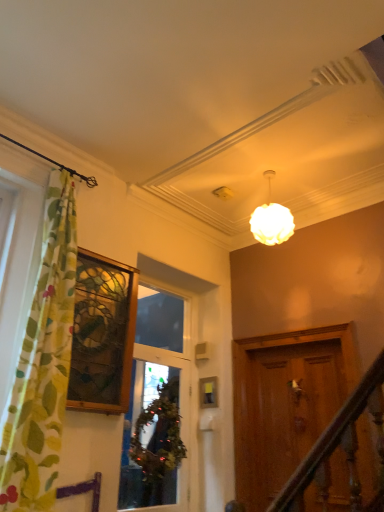
Question: From a real-world perspective, is green floral fabric curtain at left below stained glass window at left, which appears as the 1th window when viewed from the left?

Choices:
 (A) yes
 (B) no

Answer: (A)

Question: Would you say green floral fabric curtain at left is a long distance from stained glass window at left, which appears as the 1th window when viewed from the left?

Choices:
 (A) no
 (B) yes

Answer: (A)

Question: Does green floral fabric curtain at left have a smaller size compared to stained glass window at left, which appears as the 1th window when viewed from the left?

Choices:
 (A) yes
 (B) no

Answer: (B)

Question: From the image's perspective, is green floral fabric curtain at left over stained glass window at left, which appears as the 1th window when viewed from the left?

Choices:
 (A) no
 (B) yes

Answer: (B)

Question: Is green floral fabric curtain at left positioned beyond the bounds of stained glass window at left, which is the second window from right to left?

Choices:
 (A) no
 (B) yes

Answer: (B)

Question: Considering the relative positions of green floral fabric curtain at left and stained glass window at left, which appears as the 1th window when viewed from the left, in the image provided, is green floral fabric curtain at left behind stained glass window at left, which appears as the 1th window when viewed from the left,?

Choices:
 (A) yes
 (B) no

Answer: (B)

Question: Considering the relative sizes of green floral fabric curtain at left and matte white globe at upper center in the image provided, is green floral fabric curtain at left taller than matte white globe at upper center?

Choices:
 (A) no
 (B) yes

Answer: (B)

Question: From a real-world perspective, is green floral fabric curtain at left located higher than matte white globe at upper center?

Choices:
 (A) no
 (B) yes

Answer: (A)

Question: Can you confirm if green floral fabric curtain at left is smaller than matte white globe at upper center?

Choices:
 (A) yes
 (B) no

Answer: (B)

Question: From the image's perspective, is green floral fabric curtain at left under matte white globe at upper center?

Choices:
 (A) no
 (B) yes

Answer: (B)

Question: Is green floral fabric curtain at left at the right side of matte white globe at upper center?

Choices:
 (A) yes
 (B) no

Answer: (B)

Question: Would you say matte white globe at upper center is part of green floral fabric curtain at left's contents?

Choices:
 (A) no
 (B) yes

Answer: (A)

Question: Considering the relative positions of matte white globe at upper center and green leafy wreath at center in the image provided, is matte white globe at upper center to the right of green leafy wreath at center from the viewer's perspective?

Choices:
 (A) no
 (B) yes

Answer: (B)